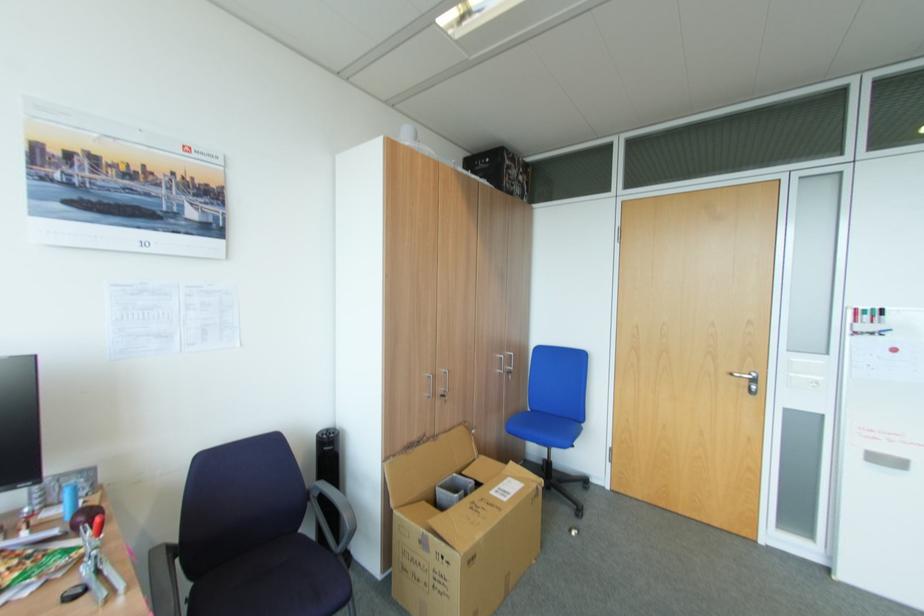
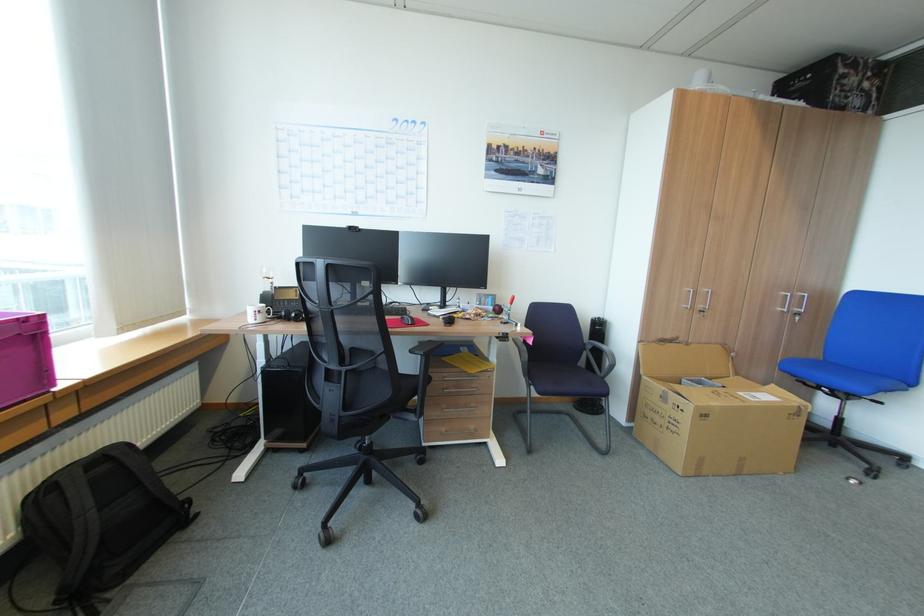
In the second image, find the point that corresponds to [515,431] in the first image.

(786, 370)